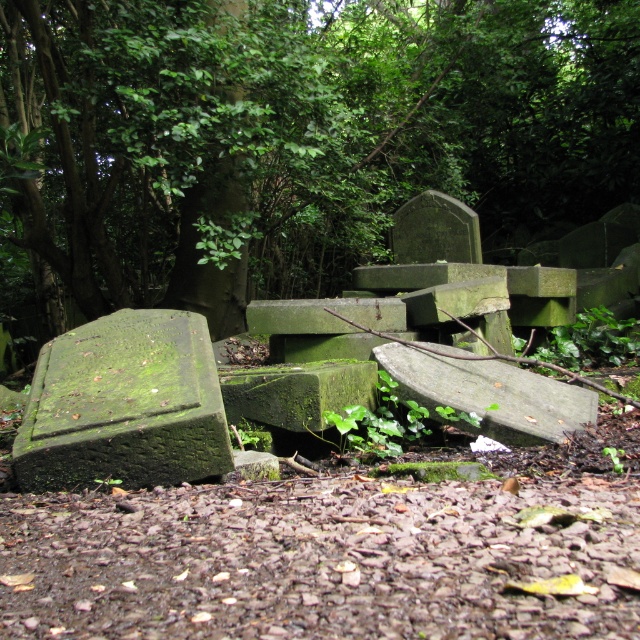
Question: Does green mossy tombstone at center appear on the right side of green mossy gravestone at lower left?

Choices:
 (A) no
 (B) yes

Answer: (B)

Question: Does green mossy tombstone at center have a greater width compared to green mossy gravestone at lower left?

Choices:
 (A) no
 (B) yes

Answer: (A)

Question: Observing the image, what is the correct spatial positioning of green mossy tombstone at center in reference to green mossy gravestone at lower left?

Choices:
 (A) below
 (B) above

Answer: (B)

Question: Which point is farther to the camera?

Choices:
 (A) (502, 100)
 (B) (86, 323)

Answer: (A)